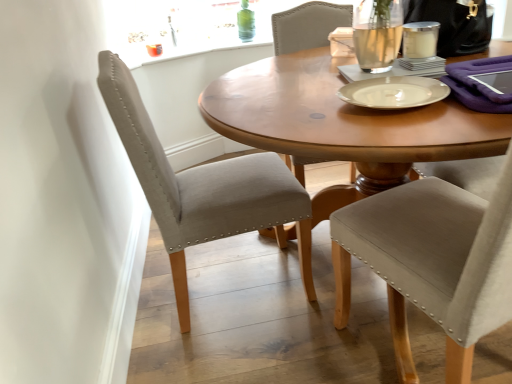
Locate an element on the screen. free space to the left of clear glass candle at upper right, the second tableware viewed from the front is located at coordinates (379, 63).